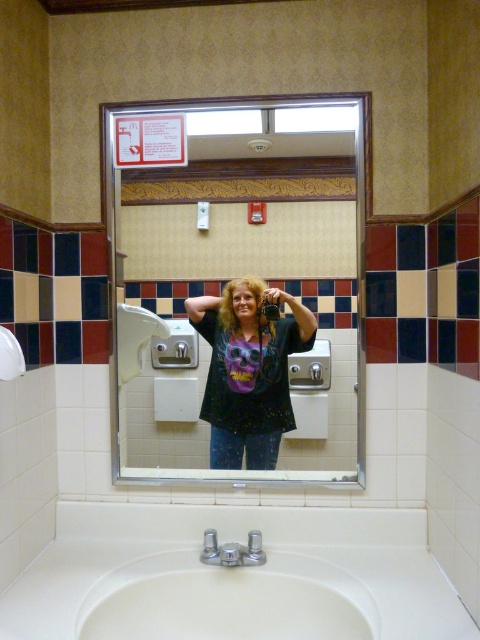
Between point (248, 298) and point (296, 634), which one is positioned in front?

Point (296, 634) is more forward.

Does clear glass mirror at upper center have a greater width compared to white glossy sink at lower center?

Yes, clear glass mirror at upper center is wider than white glossy sink at lower center.

At what (x,y) coordinates should I click in order to perform the action: click on clear glass mirror at upper center. Please return your answer as a coordinate pair (x, y). This screenshot has height=640, width=480. Looking at the image, I should click on (241, 292).

The height and width of the screenshot is (640, 480). Identify the location of clear glass mirror at upper center. (241, 292).

Looking at this image, is white glossy sink at lower center thinner than matte black t-shirt at center?

No.

Consider the image. Who is more forward, (x=141, y=596) or (x=217, y=348)?

Point (x=141, y=596)

Which is behind, point (325, 582) or point (288, 324)?

Positioned behind is point (288, 324).

Identify the location of white glossy sink at lower center. The height and width of the screenshot is (640, 480). (228, 600).

Can you confirm if clear glass mirror at upper center is smaller than matte black t-shirt at center?

Actually, clear glass mirror at upper center might be larger than matte black t-shirt at center.

This screenshot has width=480, height=640. What do you see at coordinates (241, 292) in the screenshot?
I see `clear glass mirror at upper center` at bounding box center [241, 292].

The image size is (480, 640). What do you see at coordinates (241, 292) in the screenshot?
I see `clear glass mirror at upper center` at bounding box center [241, 292].

Identify the location of clear glass mirror at upper center. Image resolution: width=480 pixels, height=640 pixels. (241, 292).